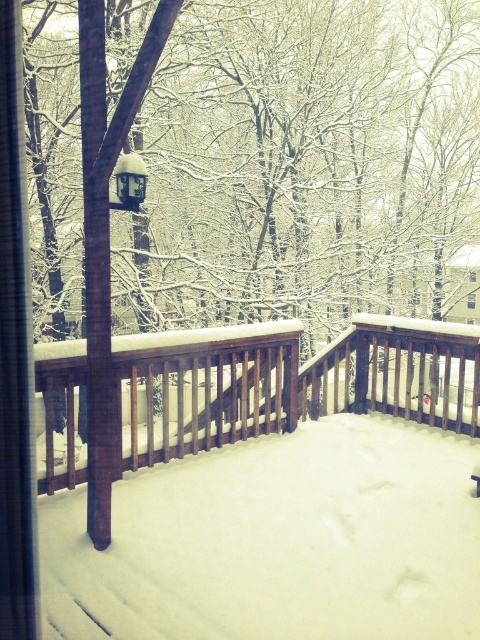
You are standing on the deck and want to place a new decorative item on the surface that is closest to you. Which object should you place it in front of, the brown wooden railing at center or the satin black lamp at center?

The brown wooden railing at center is in front of the satin black lamp at center, so you should place the decorative item in front of the brown wooden railing at center since it is closer to you.

You are designing a winter scene and want to place a new decorative item on the deck. You have a small snow globe that is 10 cm wide. The brown wooden railing at center and the satin black lamp at center are already present. Which object can the snow globe be placed next to without overlapping, considering their widths?

The snow globe can be placed next to the satin black lamp at center because the brown wooden railing at center is wider than the satin black lamp at center, so the lamp has a narrower width, allowing space for the snow globe.